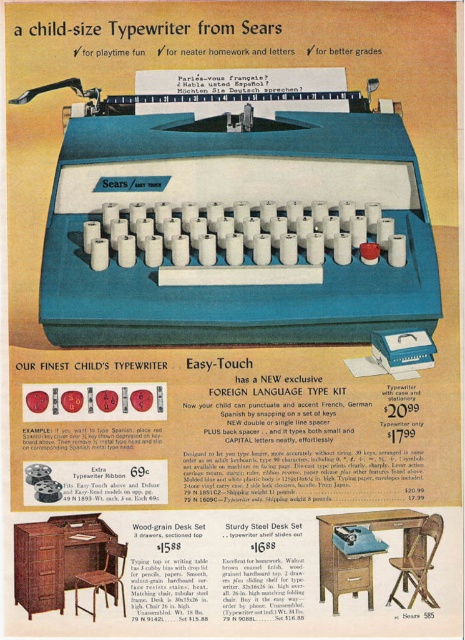
Question: Which point is closer to the camera?

Choices:
 (A) wood-grain desk set at center
 (B) wood-grain desk set at lower left

Answer: (A)

Question: Does wood-grain desk set at lower left have a smaller size compared to wood-grain desk set at center?

Choices:
 (A) no
 (B) yes

Answer: (B)

Question: Where is wood-grain desk set at lower left located in relation to wood-grain desk set at center in the image?

Choices:
 (A) left
 (B) right

Answer: (A)

Question: Can you confirm if wood-grain desk set at lower left is thinner than wood-grain desk set at center?

Choices:
 (A) yes
 (B) no

Answer: (B)

Question: Which of the following is the closest to the observer?

Choices:
 (A) (318, 564)
 (B) (30, 600)

Answer: (B)